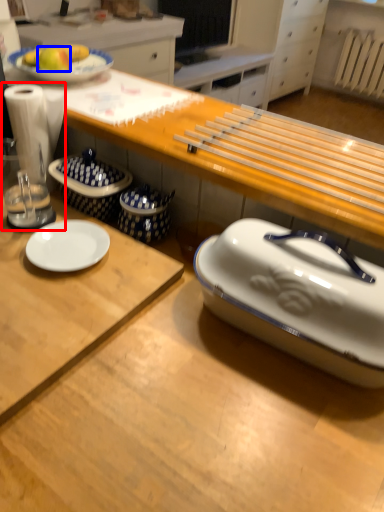
Question: Among these objects, which one is nearest to the camera, blender (highlighted by a red box) or apple (highlighted by a blue box)?

Choices:
 (A) blender
 (B) apple

Answer: (A)